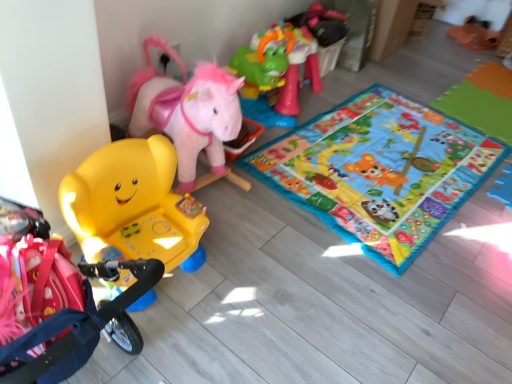
Question: Is multicolored fabric playmat at center positioned behind green plastic horse at upper right, marked as the 2th toy in a left-to-right arrangement?

Choices:
 (A) yes
 (B) no

Answer: (B)

Question: Are multicolored fabric playmat at center and green plastic horse at upper right, the 1th toy positioned from the right, making contact?

Choices:
 (A) yes
 (B) no

Answer: (B)

Question: Can you confirm if multicolored fabric playmat at center is shorter than green plastic horse at upper right, the 2th toy from the front?

Choices:
 (A) no
 (B) yes

Answer: (B)

Question: Is multicolored fabric playmat at center smaller than green plastic horse at upper right, positioned as the 2th toy in bottom-to-top order?

Choices:
 (A) no
 (B) yes

Answer: (B)

Question: Does multicolored fabric playmat at center lie in front of green plastic horse at upper right, the 1th toy positioned from the right?

Choices:
 (A) no
 (B) yes

Answer: (B)

Question: Can you confirm if multicolored fabric playmat at center is thinner than green plastic horse at upper right, positioned as the 1th toy in top-to-bottom order?

Choices:
 (A) no
 (B) yes

Answer: (A)

Question: Does matte yellow plastic chair at left, which is the first toy from bottom to top, appear on the right side of multicolored fabric playmat at center?

Choices:
 (A) no
 (B) yes

Answer: (A)

Question: From a real-world perspective, is matte yellow plastic chair at left, which is the first toy from bottom to top, over multicolored fabric playmat at center?

Choices:
 (A) yes
 (B) no

Answer: (A)

Question: Is matte yellow plastic chair at left, arranged as the second toy when viewed from the top, aimed at multicolored fabric playmat at center?

Choices:
 (A) yes
 (B) no

Answer: (B)

Question: Is matte yellow plastic chair at left, which is counted as the second toy, starting from the back, bigger than multicolored fabric playmat at center?

Choices:
 (A) no
 (B) yes

Answer: (B)

Question: Would you say matte yellow plastic chair at left, which is the first toy from bottom to top, contains multicolored fabric playmat at center?

Choices:
 (A) yes
 (B) no

Answer: (B)

Question: Considering the relative sizes of matte yellow plastic chair at left, marked as the first toy in a left-to-right arrangement, and multicolored fabric playmat at center in the image provided, is matte yellow plastic chair at left, marked as the first toy in a left-to-right arrangement, wider than multicolored fabric playmat at center?

Choices:
 (A) no
 (B) yes

Answer: (A)

Question: Does matte yellow plastic chair at left, positioned as the first toy in front-to-back order, touch green plastic horse at upper right, the 1th toy positioned from the right?

Choices:
 (A) yes
 (B) no

Answer: (B)